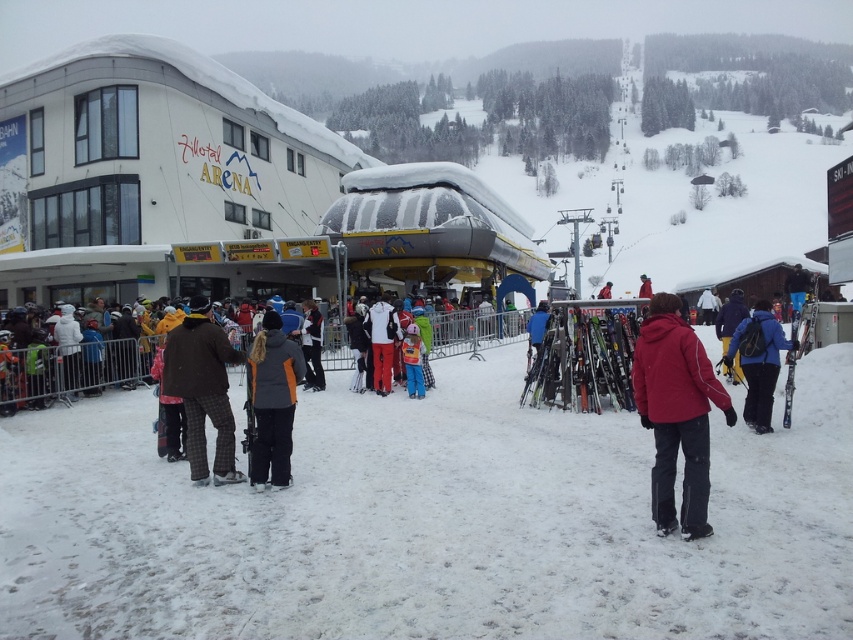
Question: Considering the relative positions of red softshell jacket at center and orange and black jacket at center in the image provided, where is red softshell jacket at center located with respect to orange and black jacket at center?

Choices:
 (A) right
 (B) left

Answer: (A)

Question: Which point is farther to the camera?

Choices:
 (A) (260, 380)
 (B) (376, 317)
 (C) (508, 417)

Answer: (B)

Question: Which object appears farthest from the camera in this image?

Choices:
 (A) orange snow pants at center
 (B) blue matte backpack at center

Answer: (A)

Question: Can you confirm if red softshell jacket at center is positioned below brown plaid pants at center?

Choices:
 (A) yes
 (B) no

Answer: (B)

Question: Which of the following is the farthest from the observer?

Choices:
 (A) red softshell jacket at center
 (B) brown plaid pants at center

Answer: (B)

Question: From the image, what is the correct spatial relationship of metallic skis at right in relation to orange snow pants at center?

Choices:
 (A) right
 (B) left

Answer: (A)